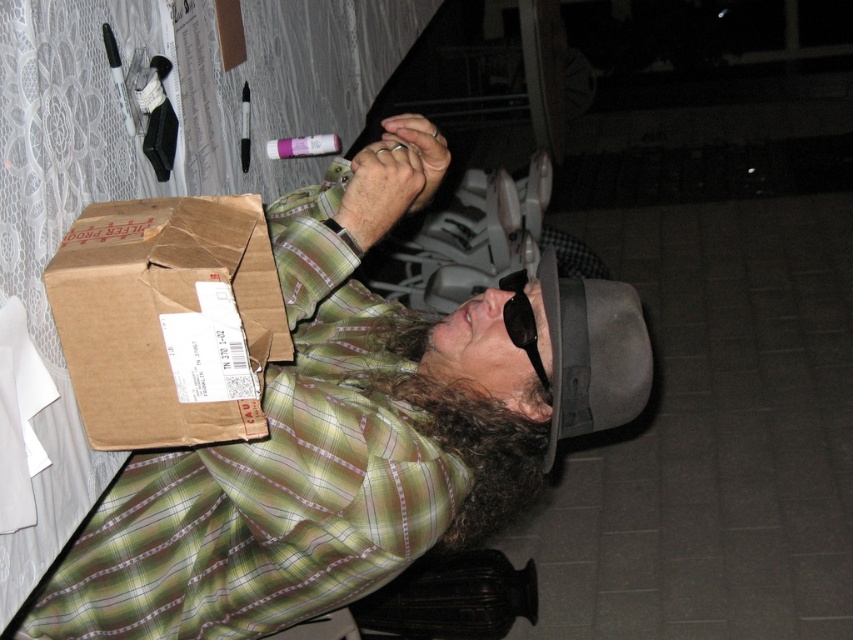
You are a delivery person who needs to place a new package between the brown cardboard box at center and the brown cardboard box at left. The new package is 4 inches wide. Can it fit between them?

The distance between the brown cardboard box at center and the brown cardboard box at left is 8.07 inches. Since the new package is 4 inches wide, it can fit between them as the space is wider than the package.